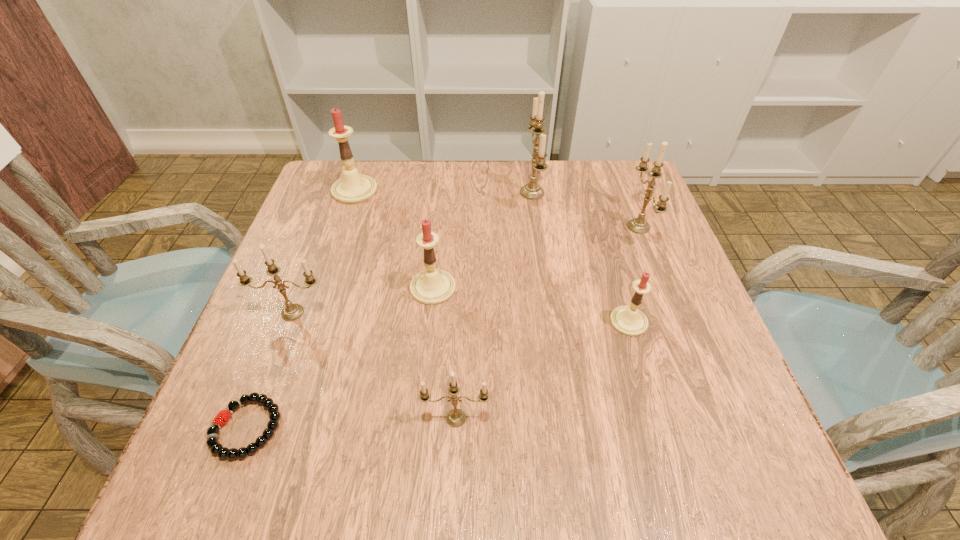
Locate an element on the screen. free region located on the front of the second smallest metallic candle is located at coordinates (237, 460).

This screenshot has width=960, height=540. In order to click on free space located on the left of the sixth candle from left to right in this screenshot , I will do `click(447, 322)`.

What are the coordinates of `free location located on the back of the second metallic candle from left to right` in the screenshot? It's located at [460, 323].

The height and width of the screenshot is (540, 960). Find the location of `vacant space situated 0.300m on the back of the black bracelet`. vacant space situated 0.300m on the back of the black bracelet is located at coordinates (306, 271).

What are the coordinates of `object located in the near edge section of the desktop` in the screenshot? It's located at (222, 417).

Locate an element on the screen. bracelet located in the left edge section of the desktop is located at coordinates (222, 417).

This screenshot has height=540, width=960. What are the coordinates of `object that is positioned at the far left corner` in the screenshot? It's located at (353, 188).

At what (x,y) coordinates should I click in order to perform the action: click on object located in the near left corner section of the desktop. Please return your answer as a coordinate pair (x, y). Looking at the image, I should click on (222, 417).

Image resolution: width=960 pixels, height=540 pixels. What are the coordinates of `object located at the far right corner` in the screenshot? It's located at (639, 225).

Where is `free spot at the far edge of the desktop`? free spot at the far edge of the desktop is located at coordinates (492, 178).